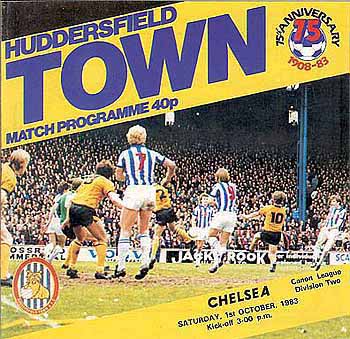
Where is `soccer picture`? The image size is (350, 339). soccer picture is located at coordinates (165, 263).